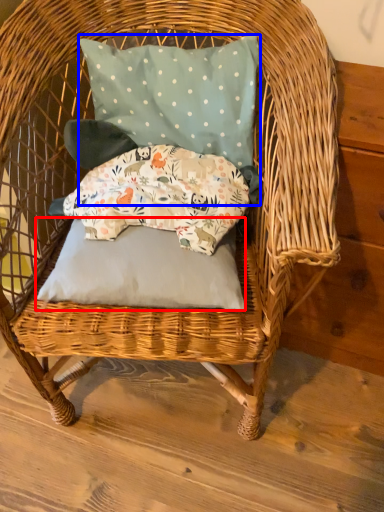
Question: Among these objects, which one is farthest to the camera, pillow (highlighted by a red box) or pillow (highlighted by a blue box)?

Choices:
 (A) pillow
 (B) pillow

Answer: (B)